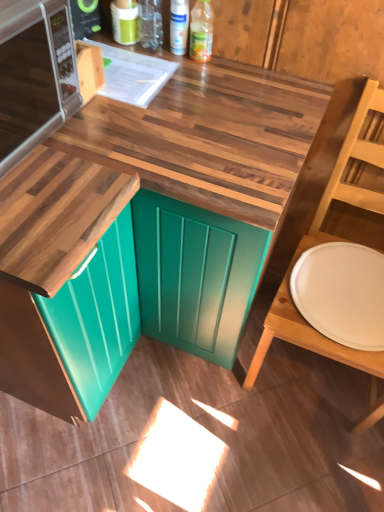
The width and height of the screenshot is (384, 512). In order to click on free space in front of translucent plastic bottle at upper center, which is the second bottle in left-to-right order in this screenshot , I will do `click(199, 84)`.